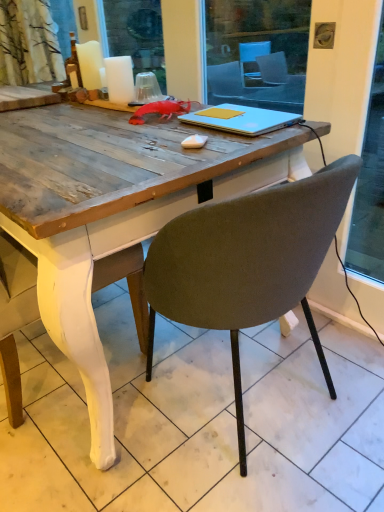
Question: Which direction should I rotate to face yellow matte notebook at center, which is the 2th notebook from bottom to top, — up or down?

Choices:
 (A) up
 (B) down

Answer: (A)

Question: Is white matte candle at upper left, which ranks as the 1th candle in back-to-front order, at the right side of white matte candle at upper left, the 2th candle when ordered from back to front?

Choices:
 (A) yes
 (B) no

Answer: (B)

Question: Is white matte candle at upper left, arranged as the 2th candle when viewed from the right, smaller than white matte candle at upper left, which is the 1th candle from front to back?

Choices:
 (A) no
 (B) yes

Answer: (A)

Question: Considering the relative sizes of white matte candle at upper left, arranged as the 2th candle when viewed from the right, and white matte candle at upper left, which is the 1th candle from front to back, in the image provided, is white matte candle at upper left, arranged as the 2th candle when viewed from the right, bigger than white matte candle at upper left, which is the 1th candle from front to back,?

Choices:
 (A) no
 (B) yes

Answer: (B)

Question: Does white matte candle at upper left, which appears as the 1th candle when viewed from the left, have a lesser width compared to white matte candle at upper left, placed as the 2th candle when sorted from left to right?

Choices:
 (A) yes
 (B) no

Answer: (B)

Question: From the image's perspective, is white matte candle at upper left, which appears as the 1th candle when viewed from the left, beneath white matte candle at upper left, which is the first candle from right to left?

Choices:
 (A) no
 (B) yes

Answer: (A)

Question: Is white matte candle at upper left, which appears as the 1th candle when viewed from the left, positioned with its back to white matte candle at upper left, which is the 1th candle from front to back?

Choices:
 (A) yes
 (B) no

Answer: (B)

Question: Considering the relative positions of silver metallic laptop at center, the 1th notebook in the bottom-to-top sequence, and white matte candle at upper left, arranged as the 2th candle when viewed from the right, in the image provided, is silver metallic laptop at center, the 1th notebook in the bottom-to-top sequence, behind white matte candle at upper left, arranged as the 2th candle when viewed from the right,?

Choices:
 (A) yes
 (B) no

Answer: (B)

Question: Is silver metallic laptop at center, the 1th notebook in the bottom-to-top sequence, bigger than white matte candle at upper left, arranged as the 2th candle when viewed from the right?

Choices:
 (A) yes
 (B) no

Answer: (A)

Question: Can you confirm if silver metallic laptop at center, marked as the 2th notebook in a top-to-bottom arrangement, is smaller than white matte candle at upper left, arranged as the 2th candle when viewed from the right?

Choices:
 (A) no
 (B) yes

Answer: (A)

Question: Is silver metallic laptop at center, marked as the 2th notebook in a top-to-bottom arrangement, not within white matte candle at upper left, which ranks as the 1th candle in back-to-front order?

Choices:
 (A) yes
 (B) no

Answer: (A)

Question: From the image's perspective, would you say silver metallic laptop at center, marked as the 2th notebook in a top-to-bottom arrangement, is positioned over white matte candle at upper left, the second candle from the front?

Choices:
 (A) yes
 (B) no

Answer: (B)

Question: Does silver metallic laptop at center, the 1th notebook in the bottom-to-top sequence, have a lesser width compared to white matte candle at upper left, the second candle from the front?

Choices:
 (A) no
 (B) yes

Answer: (A)

Question: Is yellow matte notebook at center, which is the 2th notebook from bottom to top, aimed at silver metallic laptop at center, marked as the 2th notebook in a top-to-bottom arrangement?

Choices:
 (A) no
 (B) yes

Answer: (B)